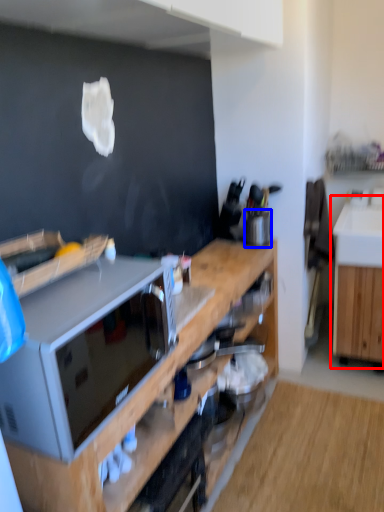
Question: Which of the following is the farthest to the observer, cabinetry (highlighted by a red box) or appliance (highlighted by a blue box)?

Choices:
 (A) cabinetry
 (B) appliance

Answer: (A)